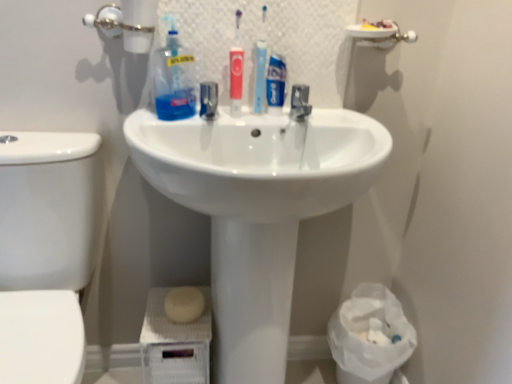
Question: Relative to white plastic bag at lower right, is metallic faucet at center in front or behind?

Choices:
 (A) front
 (B) behind

Answer: (A)

Question: Looking at the image, does metallic faucet at center seem bigger or smaller compared to white plastic bag at lower right?

Choices:
 (A) small
 (B) big

Answer: (A)

Question: Which is nearer to the matte red toothbrush at center?

Choices:
 (A) metallic faucet at center
 (B) white plastic bag at lower right
 (C) translucent plastic bottle at upper center
 (D) white glossy toilet bowl at left
 (E) white glossy sink at center

Answer: (C)

Question: Considering the real-world distances, which object is farthest from the translucent plastic bottle at upper center?

Choices:
 (A) metallic faucet at center
 (B) white glossy toilet bowl at left
 (C) blue matte toothpaste tube at center
 (D) white matte soap at lower center
 (E) white plastic bag at lower right

Answer: (E)